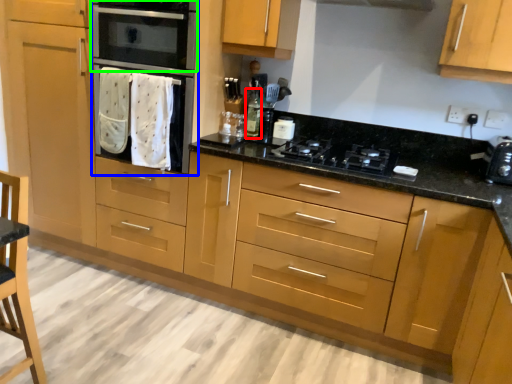
Question: Based on their relative distances, which object is nearer to bottle (highlighted by a red box)? Choose from oven (highlighted by a blue box) and home appliance (highlighted by a green box).

Choices:
 (A) oven
 (B) home appliance

Answer: (A)